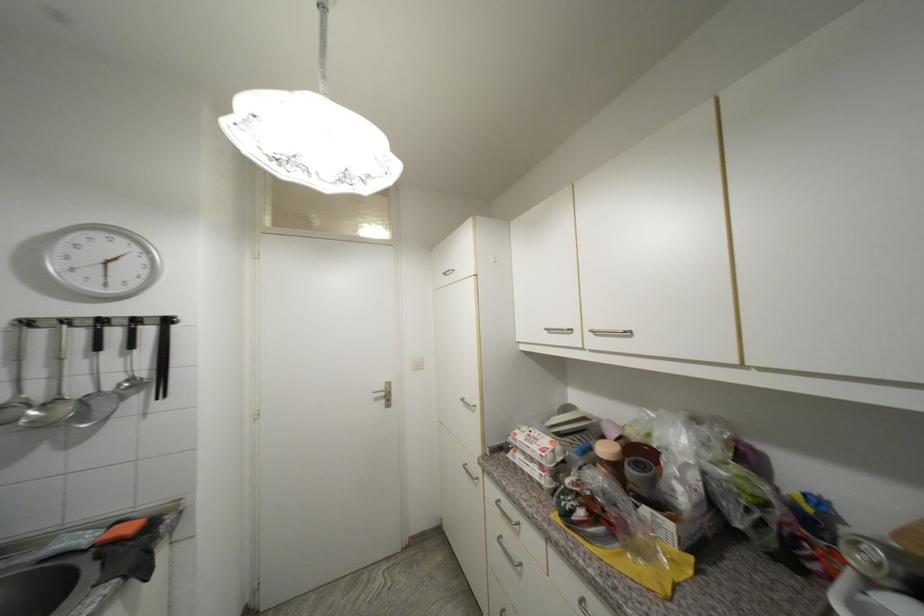
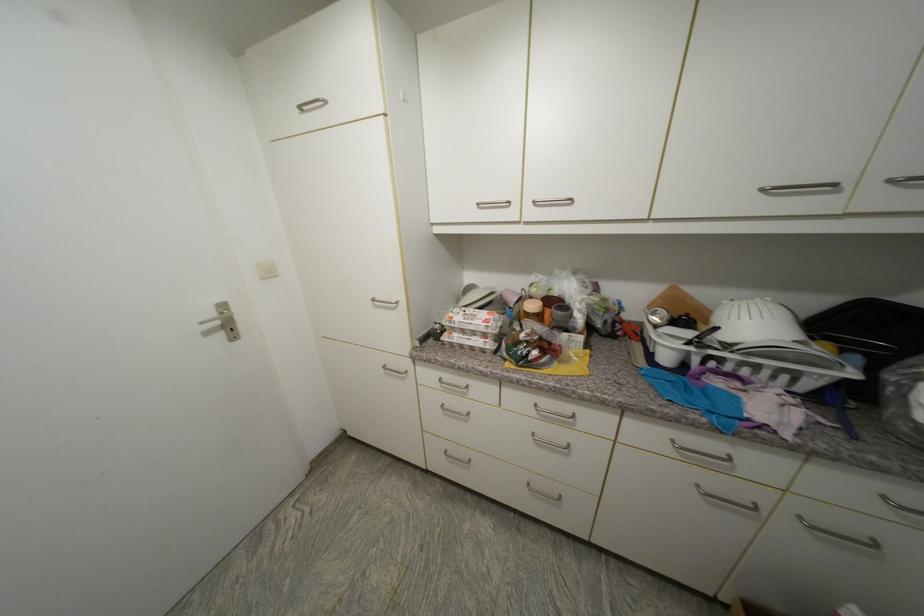
Find the pixel in the second image that matches the point at 546,468 in the first image.

(490, 337)